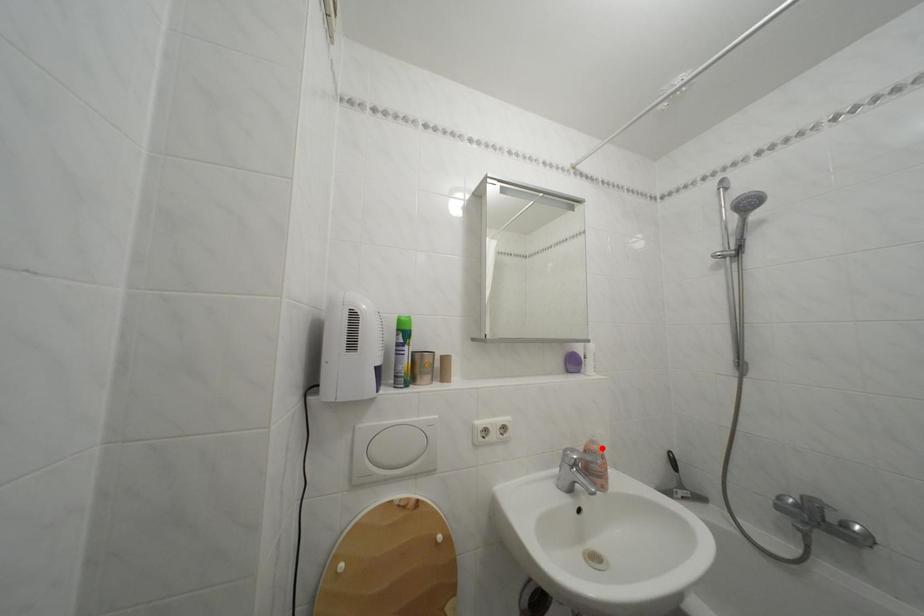
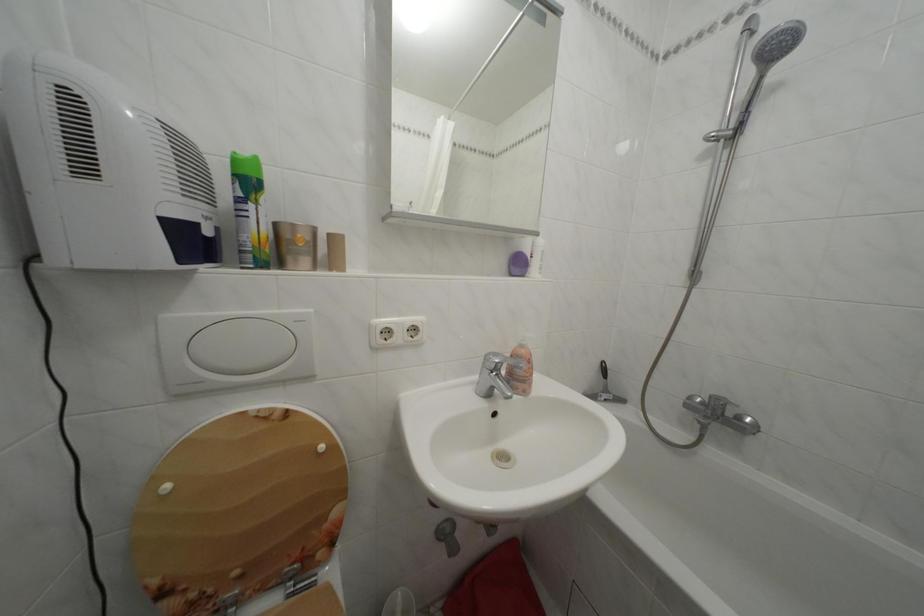
Find the pixel in the second image that matches the highlighted location in the first image.

(530, 352)